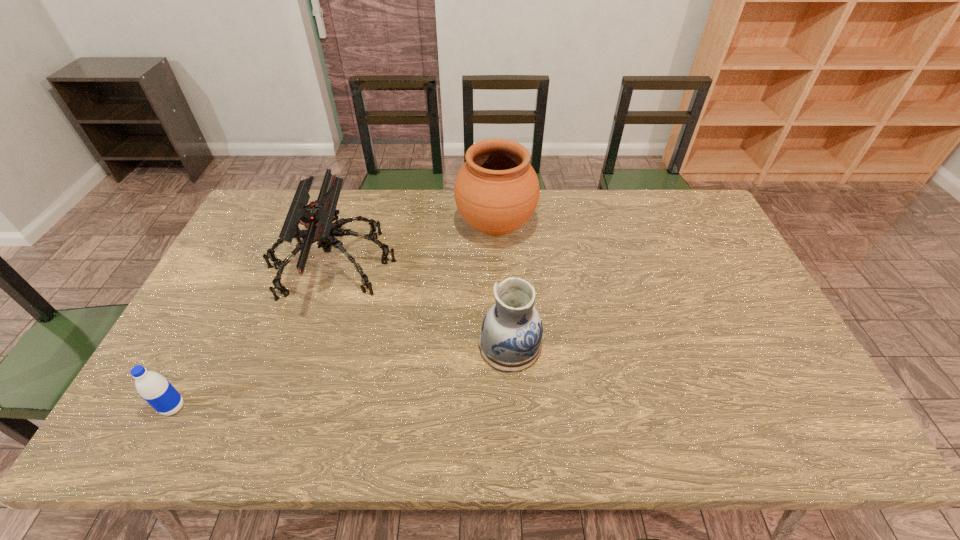
What are the coordinates of `the farther pottery` in the screenshot? It's located at (496, 190).

Locate an element on the screen. This screenshot has width=960, height=540. the third object from right to left is located at coordinates (317, 217).

This screenshot has width=960, height=540. Find the location of `the nearer pottery`. the nearer pottery is located at coordinates (510, 341).

Find the location of a particular element. This screenshot has width=960, height=540. the leftmost object is located at coordinates (153, 387).

At what (x,y) coordinates should I click in order to perform the action: click on water bottle. Please return your answer as a coordinate pair (x, y). The height and width of the screenshot is (540, 960). Looking at the image, I should click on (153, 387).

Where is `vacant space situated 0.280m on the left of the farther pottery`? The image size is (960, 540). vacant space situated 0.280m on the left of the farther pottery is located at coordinates (373, 226).

Locate an element on the screen. This screenshot has height=540, width=960. vacant space located on the right of the drone is located at coordinates (487, 265).

Locate an element on the screen. This screenshot has height=540, width=960. vacant space positioned 0.090m on the right of the nearer pottery is located at coordinates (576, 345).

I want to click on free space located on the right of the shortest object, so click(266, 407).

Identify the location of pottery that is at the far edge. (496, 190).